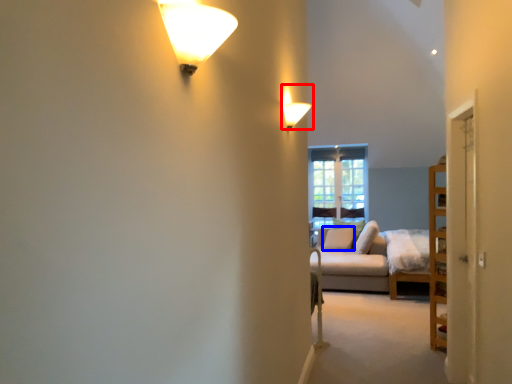
Question: Which object is closer to the camera taking this photo, lamp (highlighted by a red box) or pillow (highlighted by a blue box)?

Choices:
 (A) lamp
 (B) pillow

Answer: (A)